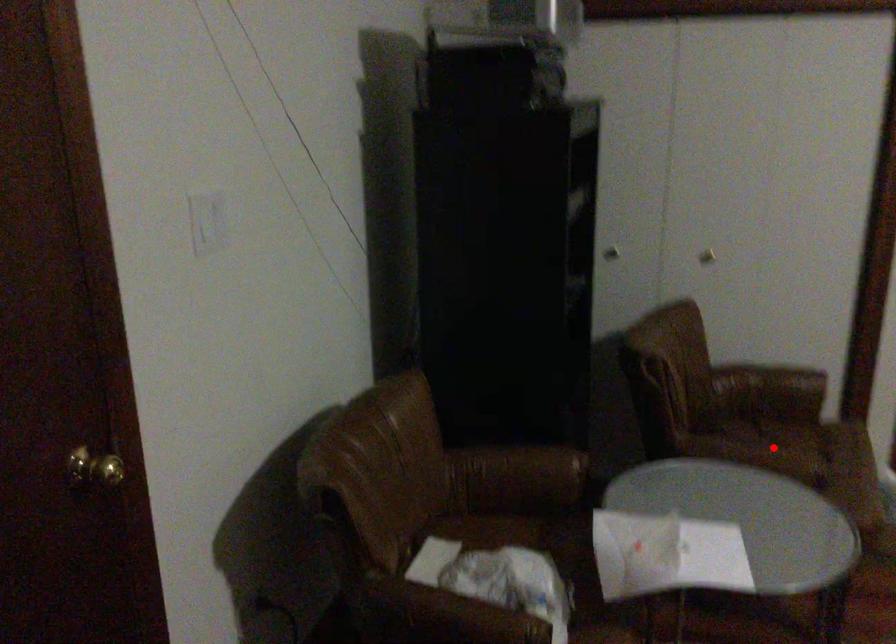
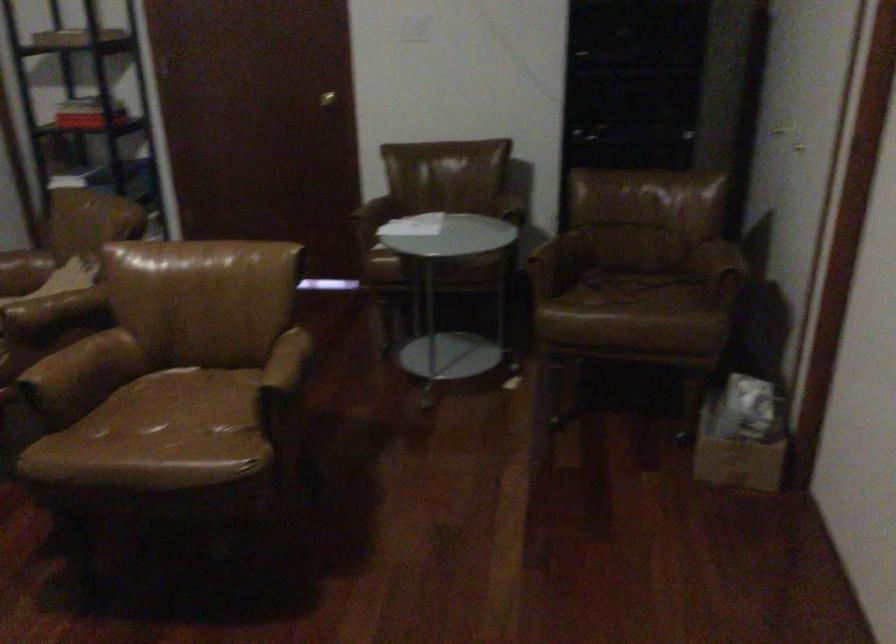
Locate, in the second image, the point that corresponds to the highlighted location in the first image.

(627, 288)